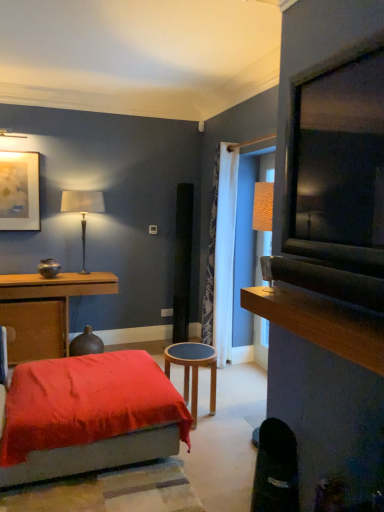
Question: Considering the positions of black leather swivel chair at lower right and wooden stool at center, arranged as the 2th table when viewed from the back, in the image, is black leather swivel chair at lower right wider or thinner than wooden stool at center, arranged as the 2th table when viewed from the back,?

Choices:
 (A) thin
 (B) wide

Answer: (A)

Question: Is black leather swivel chair at lower right to the left or to the right of wooden stool at center, arranged as the 2th table when viewed from the back, in the image?

Choices:
 (A) right
 (B) left

Answer: (A)

Question: Based on their relative distances, which object is nearer to the wooden stool at center, positioned as the 1th table in right-to-left order?

Choices:
 (A) white textured curtain at center
 (B) black leather swivel chair at lower right
 (C) wooden table at left, arranged as the first table when viewed from the left
 (D) velvet red ottoman at lower left
 (E) matte gold picture frame at upper left

Answer: (D)

Question: Estimate the real-world distances between objects in this image. Which object is farther from the metallic gold table lamp at upper left?

Choices:
 (A) white textured curtain at center
 (B) black leather swivel chair at lower right
 (C) matte gold picture frame at upper left
 (D) velvet red ottoman at lower left
 (E) wooden table at left, positioned as the 2th table in right-to-left order

Answer: (B)